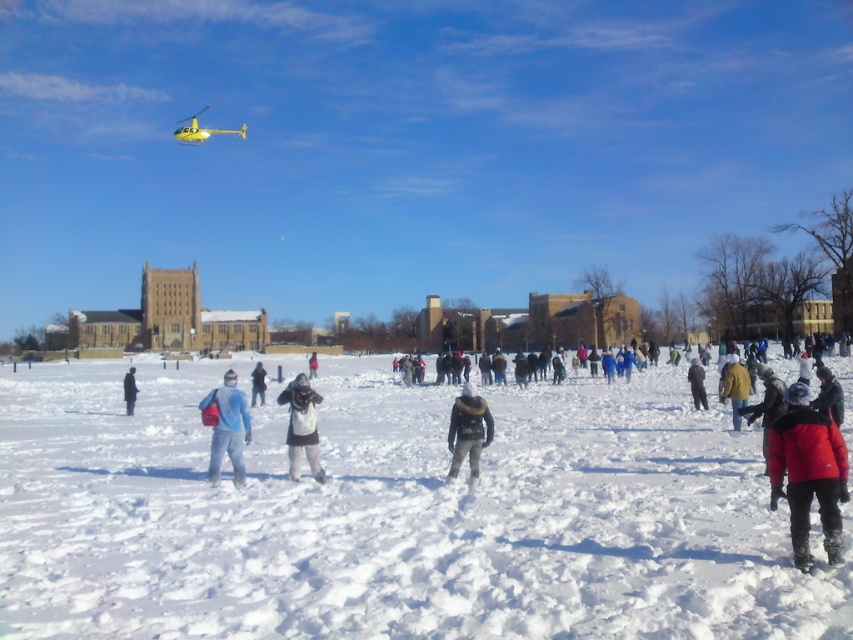
Can you confirm if white fluffy snow at center is positioned below dark gray jacket at center?

Yes.

Measure the distance between white fluffy snow at center and camera.

21.46 feet

Is point (538, 541) in front of point (256, 371)?

Yes, it is in front of point (256, 371).

This screenshot has height=640, width=853. I want to click on white fluffy snow at center, so click(x=393, y=513).

Can you confirm if white fluffy snow at center is positioned to the right of yellow woolen jacket at center?

No, white fluffy snow at center is not to the right of yellow woolen jacket at center.

The width and height of the screenshot is (853, 640). I want to click on white fluffy snow at center, so click(393, 513).

This screenshot has width=853, height=640. I want to click on white fluffy snow at center, so click(x=393, y=513).

Based on the photo, between red fleece jacket at lower right and dark gray jacket at center, which one appears on the right side from the viewer's perspective?

red fleece jacket at lower right

Between point (827, 481) and point (260, 388), which one is positioned behind?

Point (260, 388)

The width and height of the screenshot is (853, 640). I want to click on red fleece jacket at lower right, so click(808, 472).